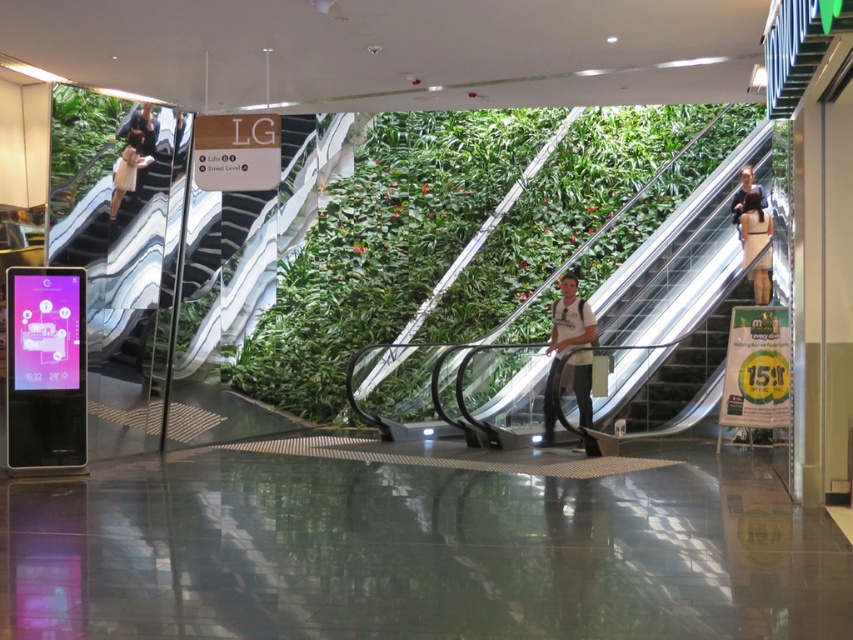
Between point (136, 112) and point (738, 205), which one is positioned behind?

The point (738, 205) is more distant.

Is dark brown leather jacket at upper left positioned before dark brown leather jacket at upper right?

Yes, it is in front of dark brown leather jacket at upper right.

Between point (137, 122) and point (756, 192), which one is positioned in front?

Point (137, 122) is more forward.

Where is `dark brown leather jacket at upper left`? The width and height of the screenshot is (853, 640). dark brown leather jacket at upper left is located at coordinates (141, 129).

Does white cotton shirt at center lie behind dark brown leather jacket at upper right?

No, it is in front of dark brown leather jacket at upper right.

Based on the photo, which of these two, white cotton shirt at center or dark brown leather jacket at upper right, stands taller?

Standing taller between the two is white cotton shirt at center.

Which is in front, point (581, 397) or point (741, 177)?

Point (581, 397) is more forward.

Where is `white cotton shirt at center`? The width and height of the screenshot is (853, 640). white cotton shirt at center is located at coordinates (572, 355).

Which of these two, green leafy wall at center or white cotton shirt at center, stands taller?

Standing taller between the two is white cotton shirt at center.

Does green leafy wall at center appear under white cotton shirt at center?

Actually, green leafy wall at center is above white cotton shirt at center.

This screenshot has height=640, width=853. I want to click on green leafy wall at center, so click(380, 248).

Where is `green leafy wall at center`? green leafy wall at center is located at coordinates (380, 248).